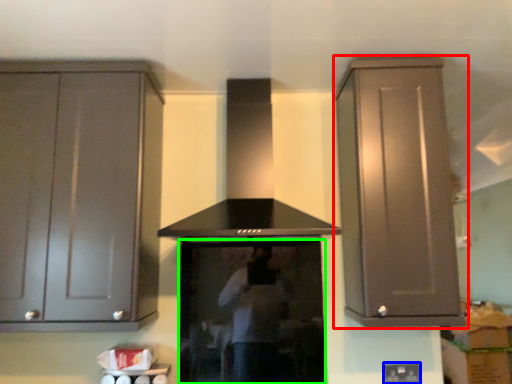
Question: Which object is the farthest from cabinetry (highlighted by a red box)? Choose among these: electric outlet (highlighted by a blue box) or appliance (highlighted by a green box).

Choices:
 (A) electric outlet
 (B) appliance

Answer: (A)